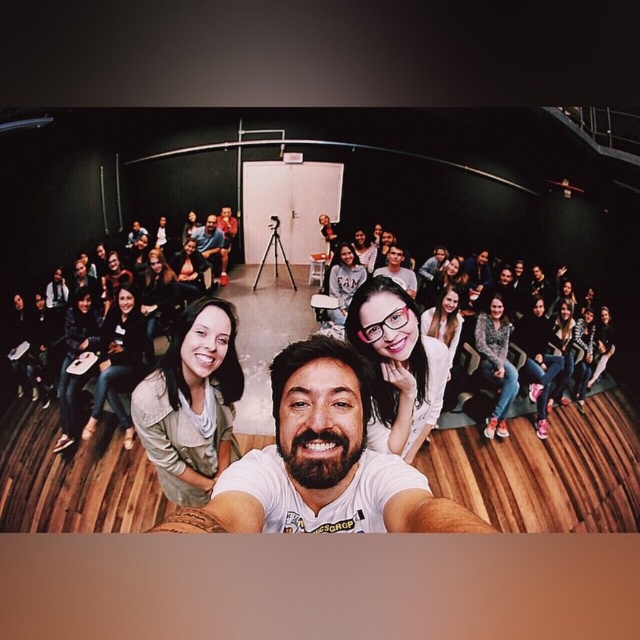
Question: Which object is farther from the camera taking this photo?

Choices:
 (A) matte gray shirt at center
 (B) white matte t-shirt at center

Answer: (A)

Question: Can you confirm if white matte t-shirt at center is positioned to the right of matte gray shirt at center?

Choices:
 (A) no
 (B) yes

Answer: (B)

Question: Does white matte t-shirt at center come in front of matte gray shirt at center?

Choices:
 (A) no
 (B) yes

Answer: (B)

Question: Among these objects, which one is nearest to the camera?

Choices:
 (A) white matte t-shirt at center
 (B) matte gray shirt at center

Answer: (A)

Question: Which object appears closest to the camera in this image?

Choices:
 (A) matte gray shirt at center
 (B) white matte t-shirt at center

Answer: (B)

Question: Does white matte t-shirt at center appear over matte gray shirt at center?

Choices:
 (A) no
 (B) yes

Answer: (A)